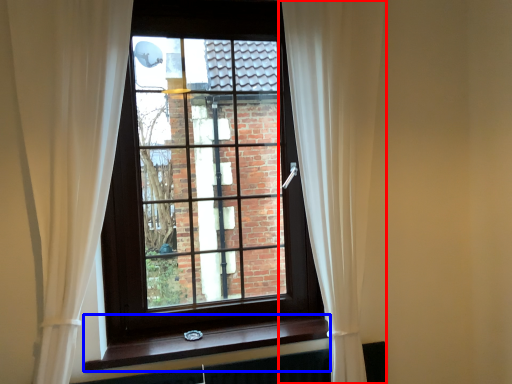
Question: Which object is further to the camera taking this photo, curtain (highlighted by a red box) or window sill (highlighted by a blue box)?

Choices:
 (A) curtain
 (B) window sill

Answer: (B)